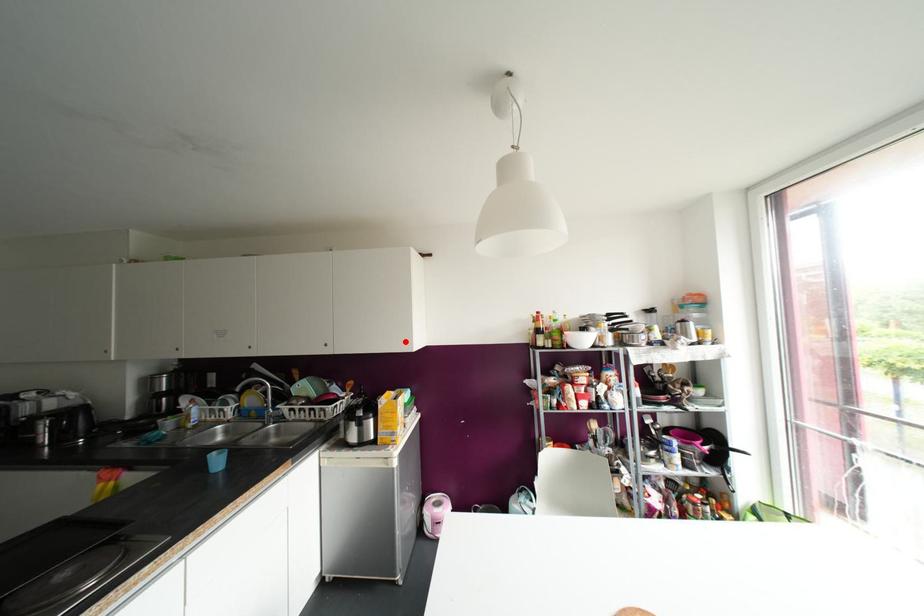
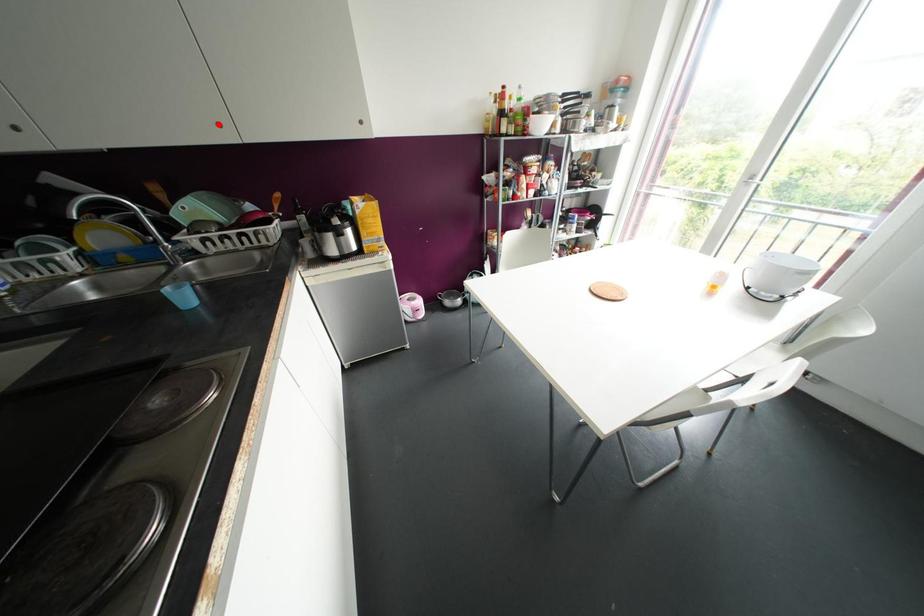
In the scene shown: I am providing you with two images of the same scene from different viewpoints. A red point is marked on the first image and another point is marked on the second image. Is the red point in image1 aligned with the point shown in image2?

No